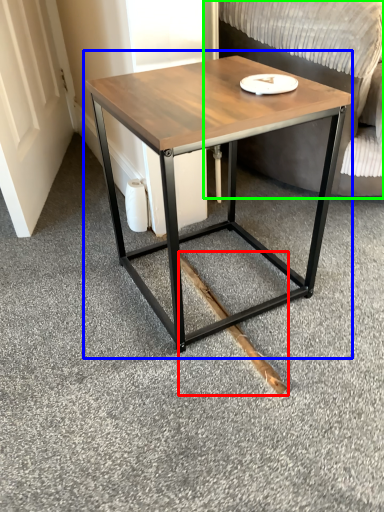
Question: Estimate the real-world distances between objects in this image. Which object is closer to wood (highlighted by a red box), coffee table (highlighted by a blue box) or swivel chair (highlighted by a green box)?

Choices:
 (A) coffee table
 (B) swivel chair

Answer: (A)